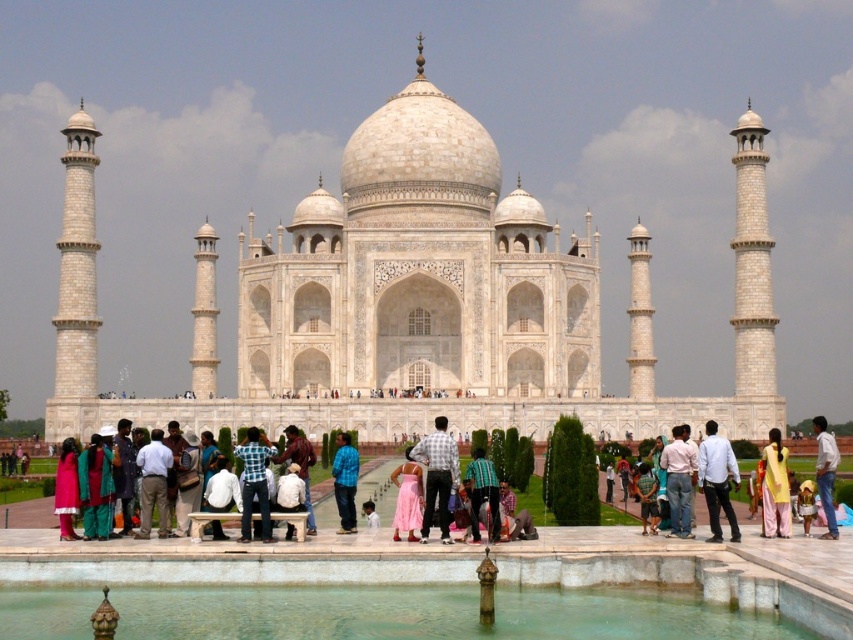
Is clear glass pool at center taller than white cotton shirt at right?

No.

Measure the distance between clear glass pool at center and camera.

clear glass pool at center is 48.90 meters away from camera.

Is point (544, 618) positioned in front of point (715, 440)?

Yes, it is in front of point (715, 440).

Find the location of a particular element. clear glass pool at center is located at coordinates (433, 612).

Between point (405, 316) and point (375, 525), which one is positioned in front?

Point (375, 525) is in front.

From the picture: Does white marble taj mahal at center have a greater height compared to light blue jeans at center?

Yes, white marble taj mahal at center is taller than light blue jeans at center.

Locate an element on the screen. Image resolution: width=853 pixels, height=640 pixels. white marble taj mahal at center is located at coordinates (419, 300).

Can you confirm if checkered fabric shirt at center is wider than checkered shirt at center?

Yes, checkered fabric shirt at center is wider than checkered shirt at center.

Between point (445, 422) and point (251, 483), which one is positioned behind?

The point (445, 422) is more distant.

Between point (453, 454) and point (253, 483), which one is positioned behind?

Positioned behind is point (453, 454).

Identify the location of checkered fabric shirt at center. This screenshot has height=640, width=853. click(x=437, y=476).